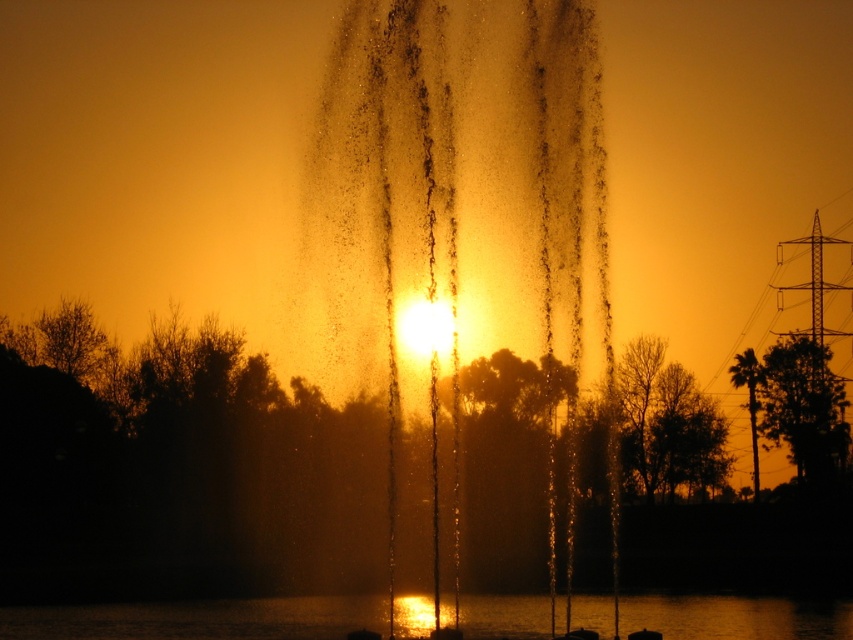
Question: Is translucent water at center positioned behind transparent liquid water at center?

Choices:
 (A) no
 (B) yes

Answer: (A)

Question: Does translucent water at center have a smaller size compared to transparent liquid water at center?

Choices:
 (A) no
 (B) yes

Answer: (A)

Question: Which object is closer to the camera taking this photo?

Choices:
 (A) translucent water at center
 (B) transparent liquid water at center

Answer: (A)

Question: Does translucent water at center appear on the right side of transparent liquid water at center?

Choices:
 (A) yes
 (B) no

Answer: (A)

Question: Which point appears farthest from the camera in this image?

Choices:
 (A) (805, 621)
 (B) (370, 65)

Answer: (A)